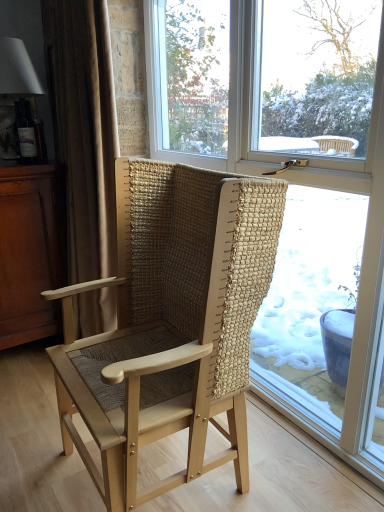
Question: From a real-world perspective, is transparent glass window at center on top of dark brown wood dresser at left?

Choices:
 (A) yes
 (B) no

Answer: (A)

Question: Is transparent glass window at center positioned before dark brown wood dresser at left?

Choices:
 (A) no
 (B) yes

Answer: (B)

Question: Is transparent glass window at center oriented towards dark brown wood dresser at left?

Choices:
 (A) yes
 (B) no

Answer: (A)

Question: Does transparent glass window at center touch dark brown wood dresser at left?

Choices:
 (A) yes
 (B) no

Answer: (B)

Question: Considering the relative sizes of transparent glass window at center and dark brown wood dresser at left in the image provided, is transparent glass window at center wider than dark brown wood dresser at left?

Choices:
 (A) no
 (B) yes

Answer: (A)

Question: Is transparent glass window at center at the left side of dark brown wood dresser at left?

Choices:
 (A) no
 (B) yes

Answer: (A)

Question: Is matte white lampshade at upper left surrounded by transparent glass window at center?

Choices:
 (A) no
 (B) yes

Answer: (A)

Question: Is transparent glass window at center far away from matte white lampshade at upper left?

Choices:
 (A) yes
 (B) no

Answer: (A)

Question: From a real-world perspective, is transparent glass window at center under matte white lampshade at upper left?

Choices:
 (A) no
 (B) yes

Answer: (B)

Question: Would you say transparent glass window at center is outside matte white lampshade at upper left?

Choices:
 (A) no
 (B) yes

Answer: (B)

Question: From the image's perspective, is transparent glass window at center beneath matte white lampshade at upper left?

Choices:
 (A) no
 (B) yes

Answer: (B)

Question: Is transparent glass window at center in contact with matte white lampshade at upper left?

Choices:
 (A) yes
 (B) no

Answer: (B)

Question: Is dark brown wood dresser at left far away from beige fabric curtain at left?

Choices:
 (A) no
 (B) yes

Answer: (A)